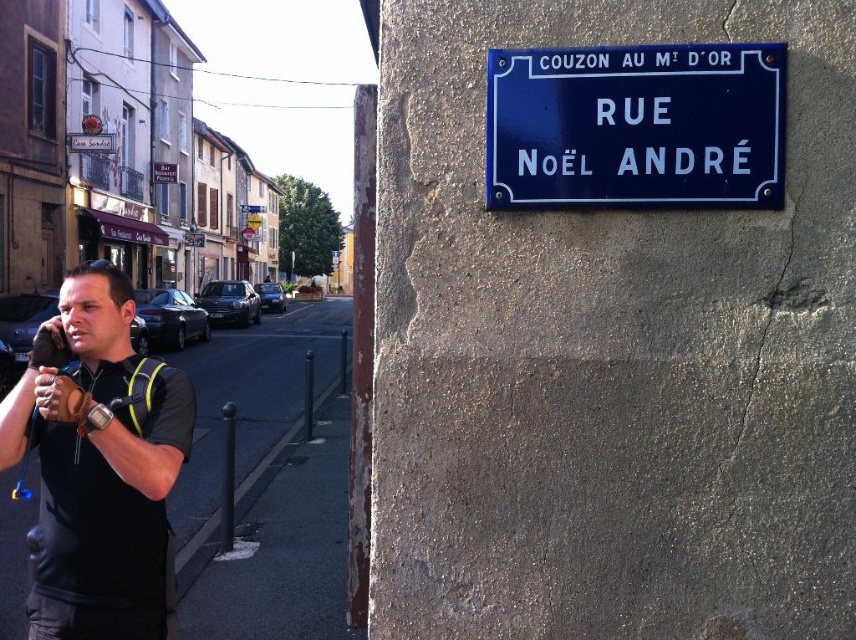
Does point (48, 436) lie in front of point (749, 202)?

No, (48, 436) is further to viewer.

Which is above, black fabric shirt at left or blue enameled sign at upper right?

Positioned higher is blue enameled sign at upper right.

At what (x,y) coordinates should I click in order to perform the action: click on black fabric shirt at left. Please return your answer as a coordinate pair (x, y). Looking at the image, I should click on (99, 465).